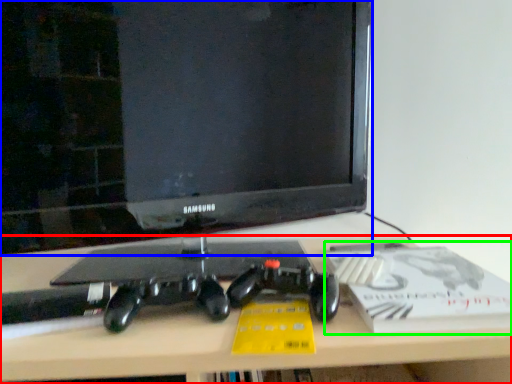
Question: Which object is the farthest from desk (highlighted by a red box)? Choose among these: television (highlighted by a blue box) or paperback book (highlighted by a green box).

Choices:
 (A) television
 (B) paperback book

Answer: (A)